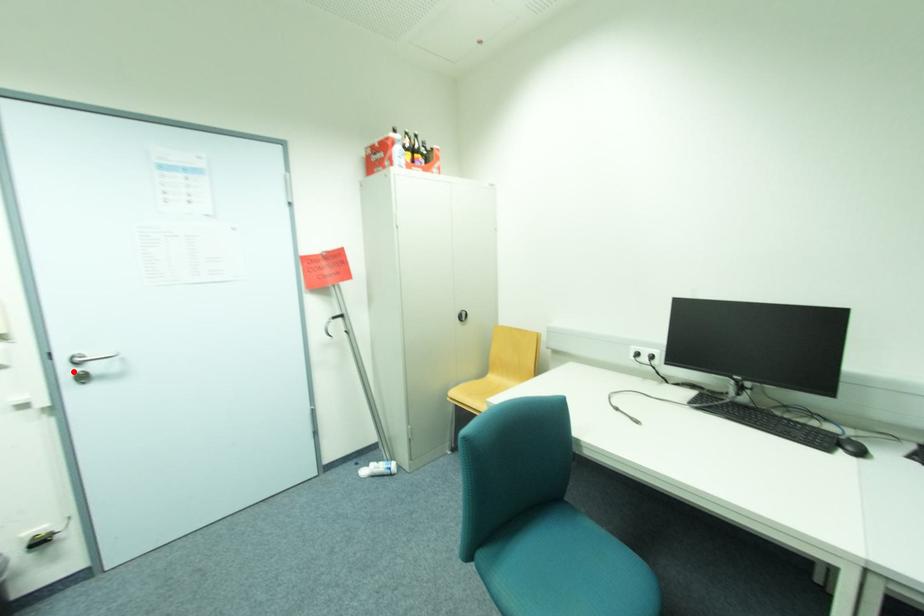
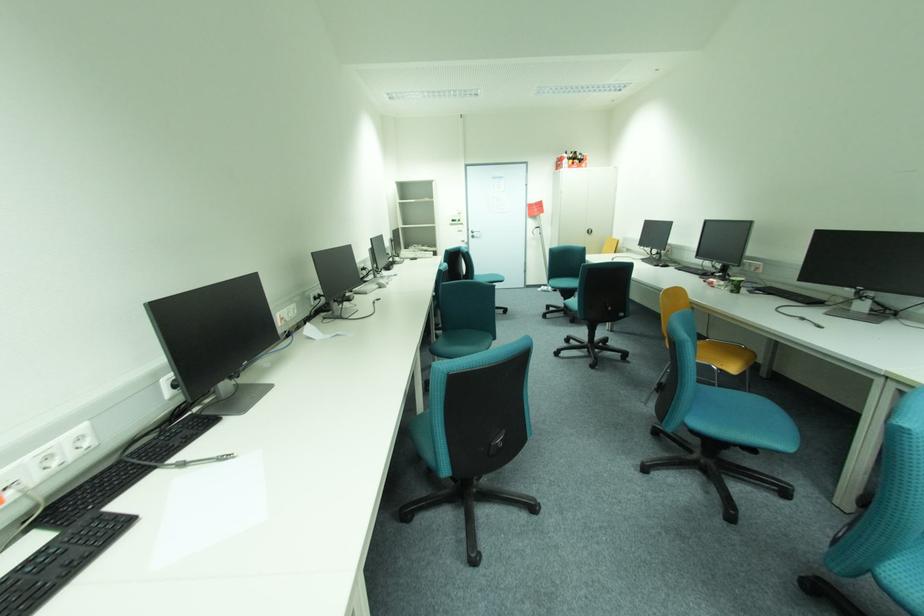
Question: I am providing you with two images of the same scene from different viewpoints. A red point is shown in image1. For the corresponding object point in image2, is it positioned nearer or farther from the camera?

Choices:
 (A) Nearer
 (B) Farther

Answer: (A)